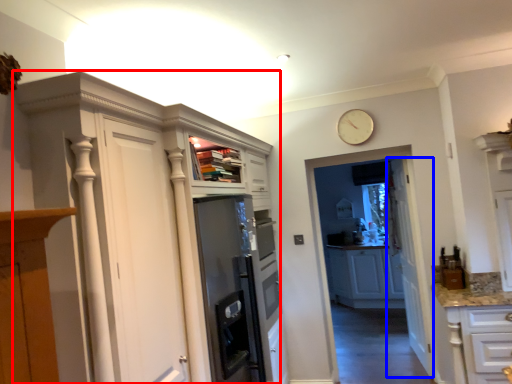
Question: Among these objects, which one is farthest to the camera, cupboard (highlighted by a red box) or door (highlighted by a blue box)?

Choices:
 (A) cupboard
 (B) door

Answer: (B)